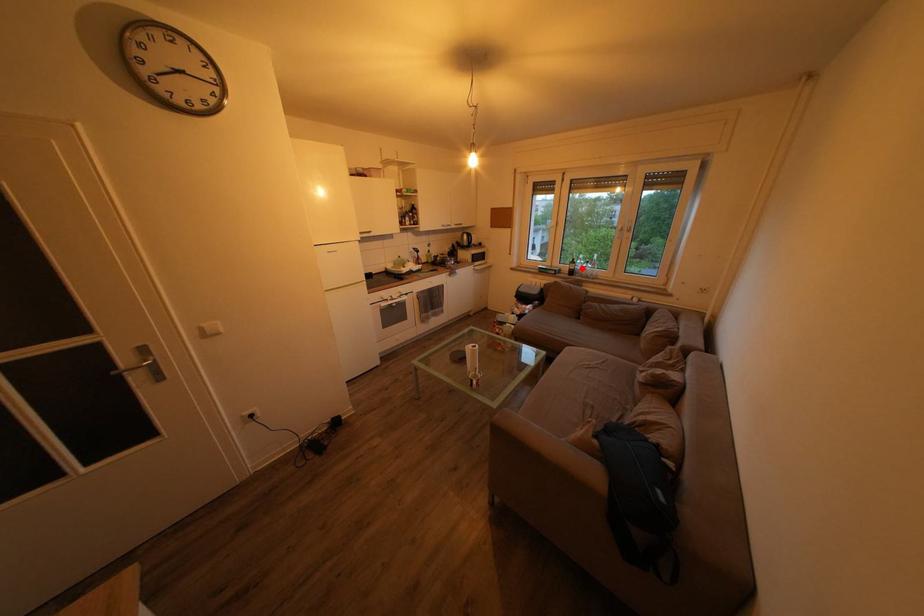
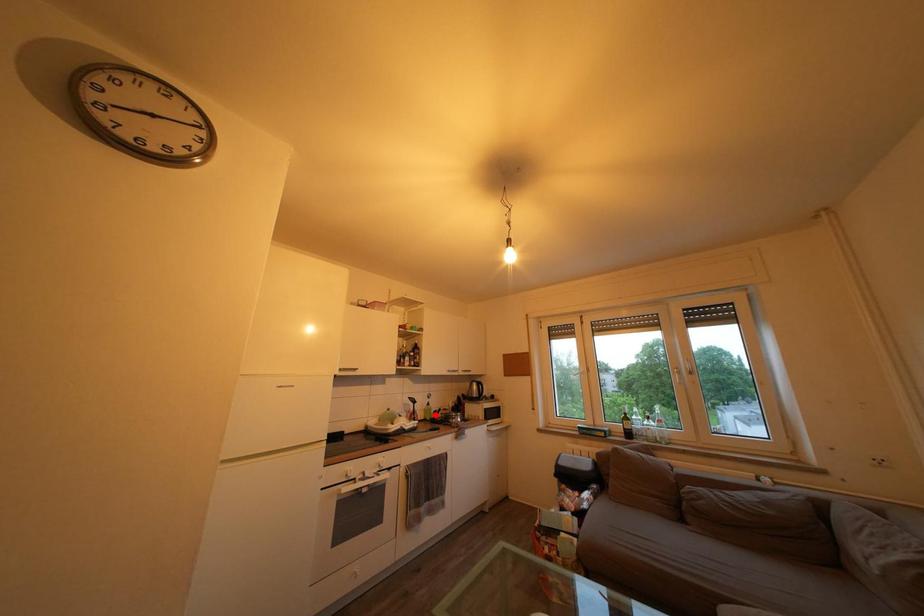
I am providing you with two images of the same scene from different viewpoints. A red point is marked on the first image and another point is marked on the second image. Is the marked point in image1 the same physical position as the marked point in image2?

No